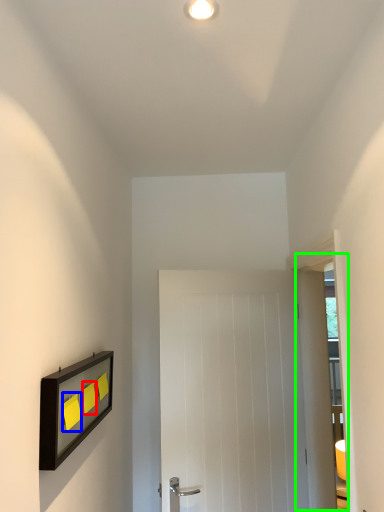
Question: Considering the real-world distances, which object is closest to light switch (highlighted by a red box)? light switch (highlighted by a blue box) or glass door (highlighted by a green box).

Choices:
 (A) light switch
 (B) glass door

Answer: (A)